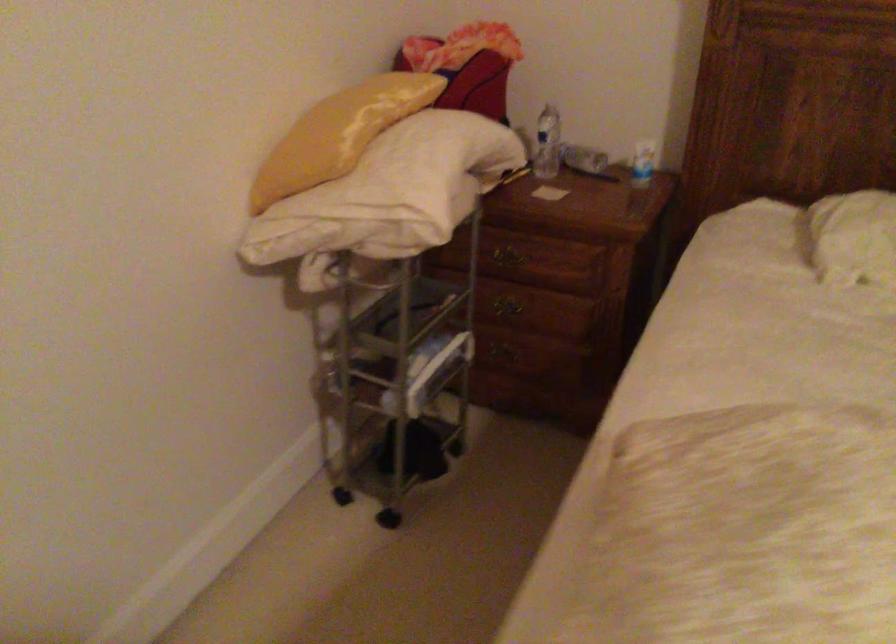
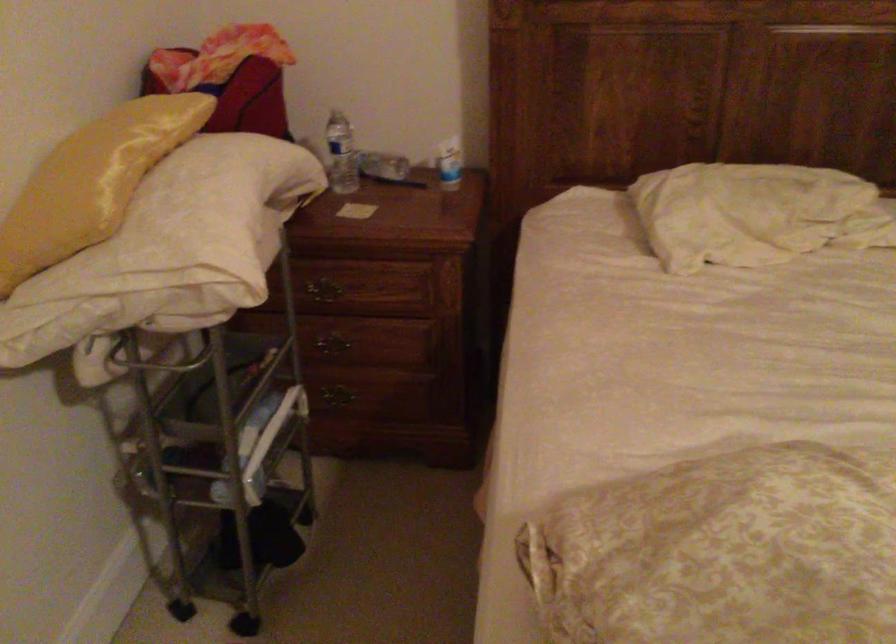
Question: In a continuous first-person perspective shot, in which direction is the camera moving?

Choices:
 (A) Left
 (B) Right
 (C) Forward
 (D) Backward

Answer: (C)